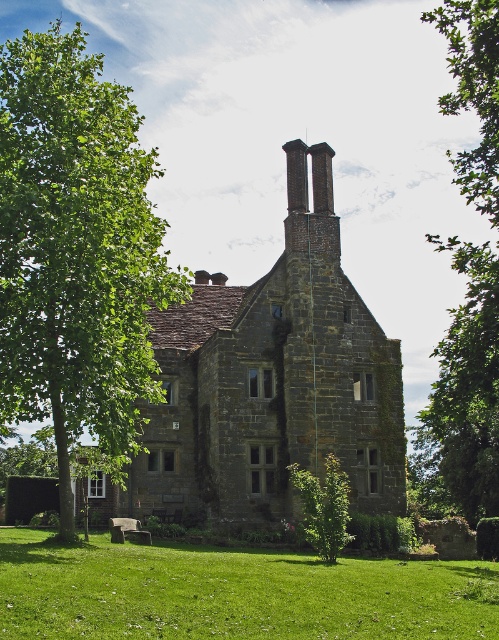
Is green leafy tree at upper right below green leafy tree at center?

No.

Describe the element at coordinates (468, 385) in the screenshot. I see `green leafy tree at upper right` at that location.

Does point (494, 314) come farther from viewer compared to point (317, 513)?

Yes, point (494, 314) is farther from viewer.

Find the location of `green leafy tree at upper right`. green leafy tree at upper right is located at coordinates (468, 385).

Which of these two, green grass at lower center or green leafy tree at upper right, stands taller?

Result: With more height is green leafy tree at upper right.

Looking at this image, who is positioned more to the right, green grass at lower center or green leafy tree at upper right?

Positioned to the right is green leafy tree at upper right.

The image size is (499, 640). What are the coordinates of `green grass at lower center` in the screenshot? It's located at (234, 593).

Can you confirm if green grass at lower center is smaller than green leafy tree at center?

No.

Between point (339, 561) and point (331, 508), which one is positioned behind?

The point (339, 561) is more distant.

Locate an element on the screen. The image size is (499, 640). green grass at lower center is located at coordinates (234, 593).